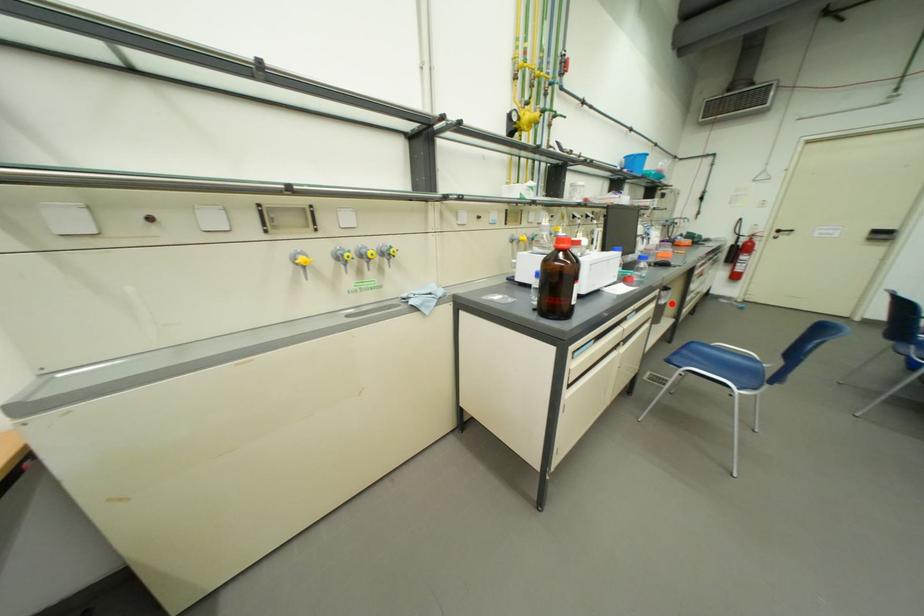
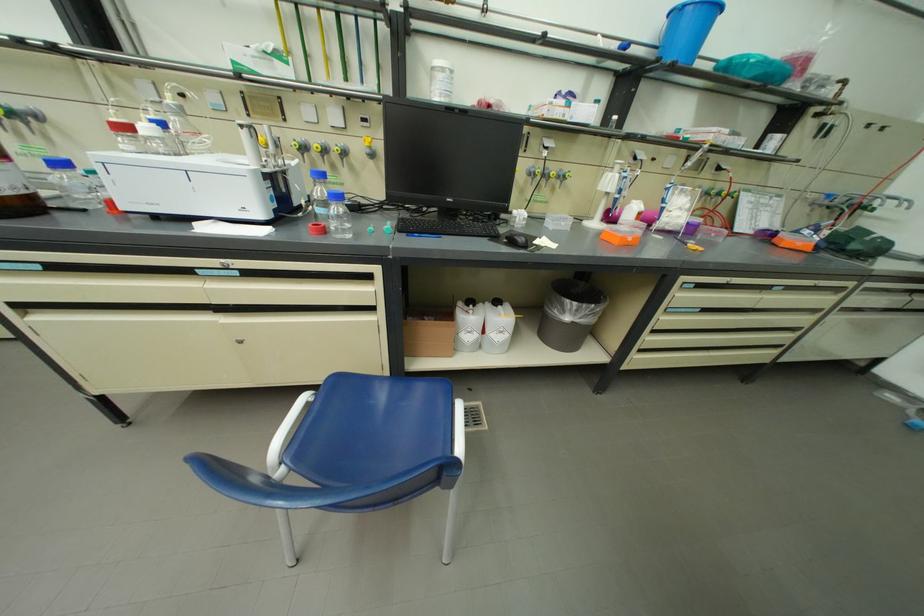
Question: I am providing you with two images of the same scene from different viewpoints. A red point is marked on the first image. Is the red point's position out of view in image 2?

Choices:
 (A) Yes
 (B) No

Answer: (B)